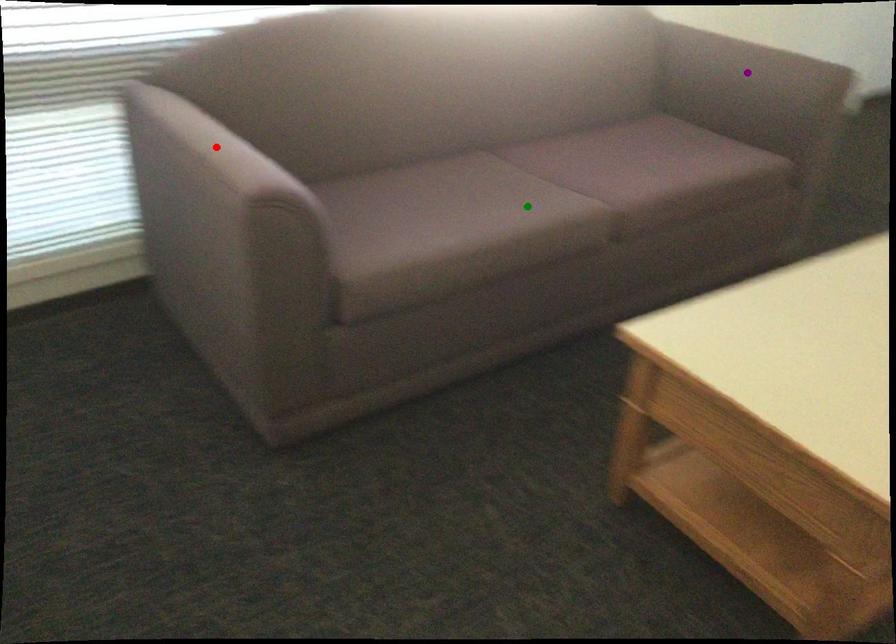
Order these from nearest to farthest:
purple point
red point
green point

1. red point
2. green point
3. purple point